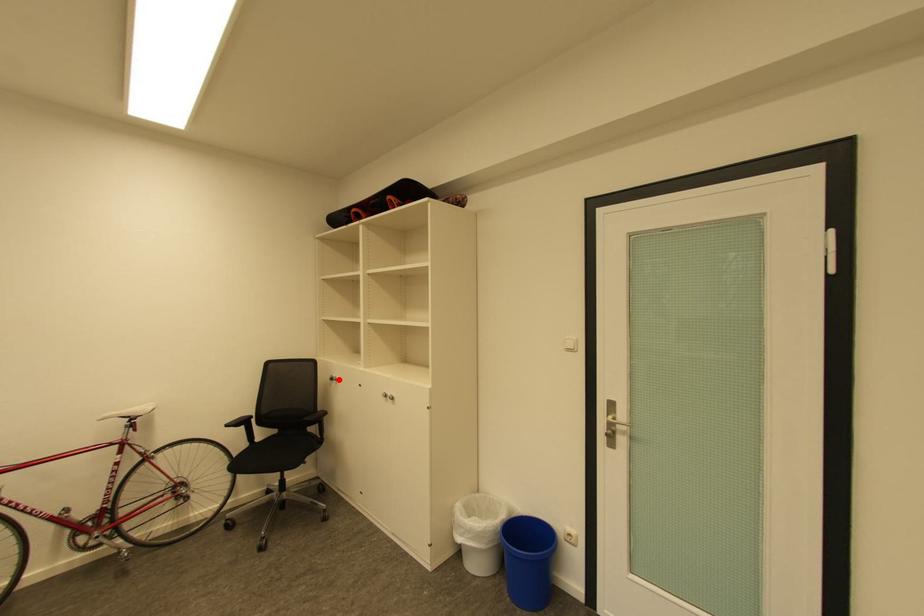
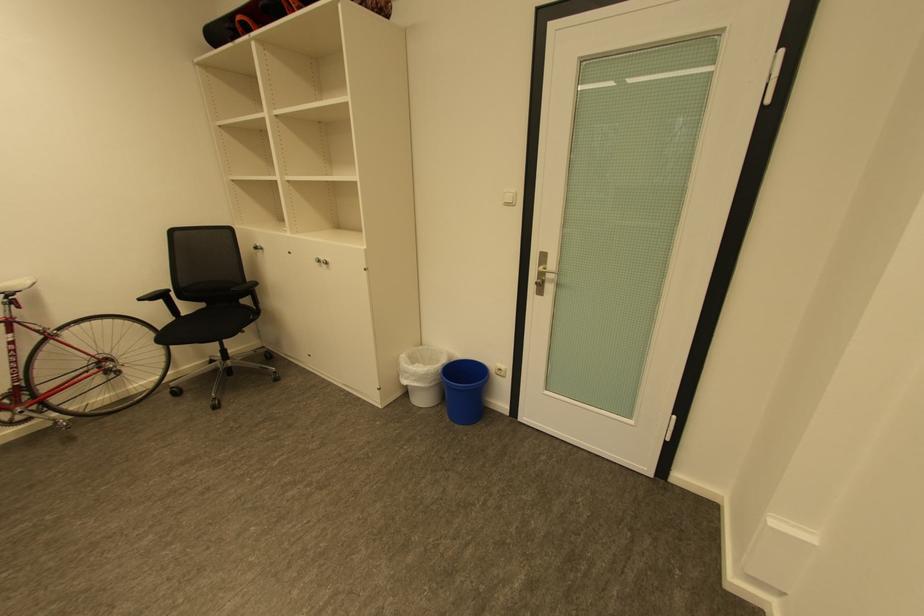
Locate, in the second image, the point that corresponds to the highlighted location in the first image.

(262, 248)